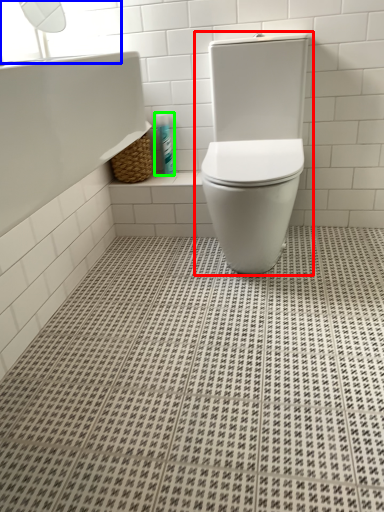
Question: Which is farther away from toilet (highlighted by a red box)? window screen (highlighted by a blue box) or toiletry (highlighted by a green box)?

Choices:
 (A) window screen
 (B) toiletry

Answer: (A)